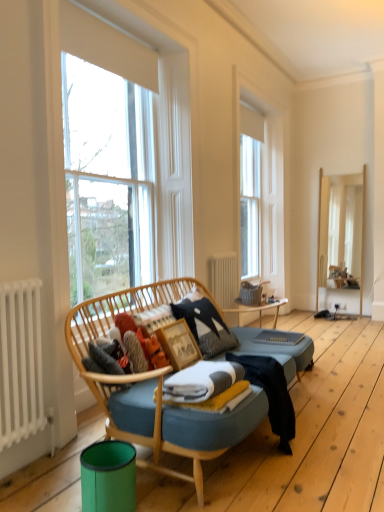
Question: Is wooden mirror at right shorter than white wood window frame at upper center?

Choices:
 (A) no
 (B) yes

Answer: (B)

Question: Is wooden mirror at right oriented towards white wood window frame at upper center?

Choices:
 (A) yes
 (B) no

Answer: (B)

Question: Is wooden mirror at right taller than white wood window frame at upper center?

Choices:
 (A) yes
 (B) no

Answer: (B)

Question: From the image's perspective, is wooden mirror at right below white wood window frame at upper center?

Choices:
 (A) no
 (B) yes

Answer: (B)

Question: Is the depth of wooden mirror at right less than that of white wood window frame at upper center?

Choices:
 (A) no
 (B) yes

Answer: (A)

Question: Can you confirm if wooden mirror at right is positioned to the left of white wood window frame at upper center?

Choices:
 (A) yes
 (B) no

Answer: (B)

Question: Is white metallic radiator at left, arranged as the second radiator when viewed from the back, smaller than fluffy fabric laundry at center?

Choices:
 (A) yes
 (B) no

Answer: (B)

Question: Is white metallic radiator at left, which is the 1th radiator in left-to-right order, closer to camera compared to fluffy fabric laundry at center?

Choices:
 (A) yes
 (B) no

Answer: (A)

Question: Would you say white metallic radiator at left, placed as the first radiator when sorted from front to back, contains fluffy fabric laundry at center?

Choices:
 (A) no
 (B) yes

Answer: (A)

Question: From the image's perspective, is white metallic radiator at left, which is the 1th radiator in left-to-right order, below fluffy fabric laundry at center?

Choices:
 (A) no
 (B) yes

Answer: (B)

Question: Is white metallic radiator at left, which is the 1th radiator in left-to-right order, wider than fluffy fabric laundry at center?

Choices:
 (A) no
 (B) yes

Answer: (A)

Question: Does white metallic radiator at left, which is the 1th radiator in left-to-right order, appear on the right side of fluffy fabric laundry at center?

Choices:
 (A) no
 (B) yes

Answer: (A)

Question: From the image's perspective, is fluffy orange plush at center above fluffy fabric laundry at center?

Choices:
 (A) yes
 (B) no

Answer: (B)